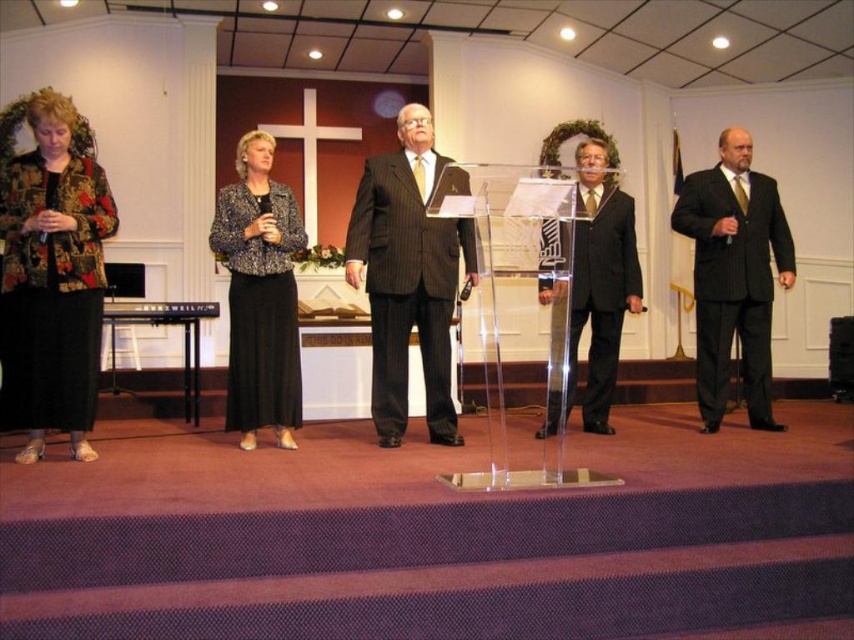
Question: Does patterned fabric jacket at center have a smaller size compared to matte black suit at center?

Choices:
 (A) yes
 (B) no

Answer: (A)

Question: Is pinstriped suit at center behind matte black suit at right?

Choices:
 (A) yes
 (B) no

Answer: (B)

Question: Does pinstriped suit at center appear over matte black suit at center?

Choices:
 (A) no
 (B) yes

Answer: (B)

Question: Which object is farther from the camera taking this photo?

Choices:
 (A) floral-patterned fabric jacket at left
 (B) pinstriped suit at center

Answer: (B)

Question: Which point is closer to the camera taking this photo?

Choices:
 (A) (232, 396)
 (B) (28, 291)

Answer: (B)

Question: Among these objects, which one is nearest to the camera?

Choices:
 (A) patterned fabric jacket at center
 (B) matte black suit at center

Answer: (B)